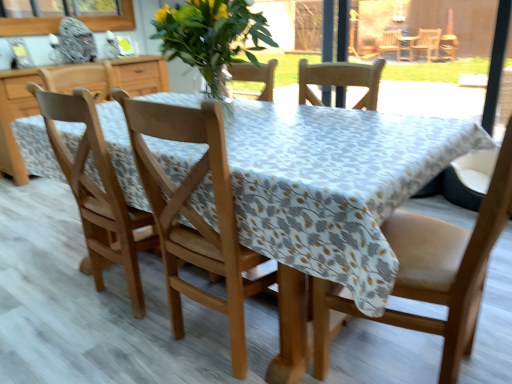
Question: From a real-world perspective, is wooden chair at left, the 1th chair in the left-to-right sequence, below leather at right, marked as the third chair in a left-to-right arrangement?

Choices:
 (A) no
 (B) yes

Answer: (B)

Question: Does wooden chair at left, the 1th chair in the left-to-right sequence, have a lesser height compared to leather at right, placed as the first chair when sorted from right to left?

Choices:
 (A) no
 (B) yes

Answer: (A)

Question: Would you say leather at right, placed as the first chair when sorted from right to left, is part of wooden chair at left, which is the third chair from right to left,'s contents?

Choices:
 (A) yes
 (B) no

Answer: (B)

Question: From the image's perspective, is wooden chair at left, which is the third chair from right to left, under leather at right, marked as the third chair in a left-to-right arrangement?

Choices:
 (A) yes
 (B) no

Answer: (B)

Question: Does wooden chair at left, the 1th chair in the left-to-right sequence, turn towards leather at right, marked as the third chair in a left-to-right arrangement?

Choices:
 (A) yes
 (B) no

Answer: (B)

Question: Is wooden chair at left, the 1th chair in the left-to-right sequence, next to leather at right, placed as the first chair when sorted from right to left?

Choices:
 (A) no
 (B) yes

Answer: (A)

Question: Is wooden chair at center, marked as the 2th chair in a right-to-left arrangement, next to wooden chair at left, which is the third chair from right to left, and touching it?

Choices:
 (A) yes
 (B) no

Answer: (B)

Question: Can you confirm if wooden chair at center, marked as the 2th chair in a right-to-left arrangement, is bigger than wooden chair at left, the 1th chair in the left-to-right sequence?

Choices:
 (A) no
 (B) yes

Answer: (B)

Question: Does wooden chair at center, the 2th chair viewed from the left, have a greater height compared to wooden chair at left, which is the third chair from right to left?

Choices:
 (A) no
 (B) yes

Answer: (A)

Question: Is there a large distance between wooden chair at center, the 2th chair viewed from the left, and wooden chair at left, which is the third chair from right to left?

Choices:
 (A) no
 (B) yes

Answer: (A)

Question: Is wooden chair at center, the 2th chair viewed from the left, positioned with its back to wooden chair at left, the 1th chair in the left-to-right sequence?

Choices:
 (A) yes
 (B) no

Answer: (B)

Question: Can you confirm if wooden chair at center, marked as the 2th chair in a right-to-left arrangement, is thinner than wooden chair at left, which is the third chair from right to left?

Choices:
 (A) yes
 (B) no

Answer: (B)

Question: Is the depth of leather at right, placed as the first chair when sorted from right to left, greater than that of clear glass window screen at upper left?

Choices:
 (A) yes
 (B) no

Answer: (B)